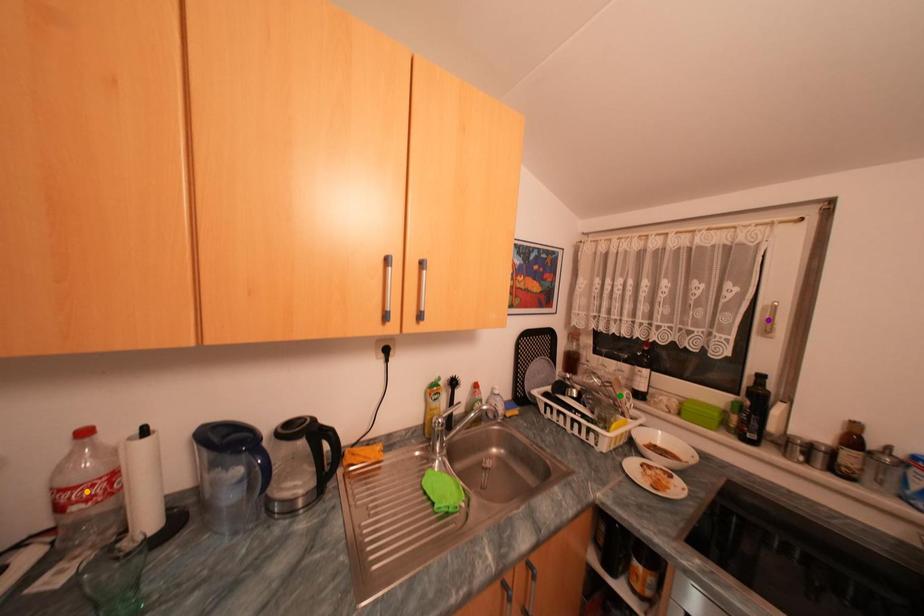
Order these from nearest to farthest:
1. purple point
2. green point
3. orange point

1. orange point
2. purple point
3. green point